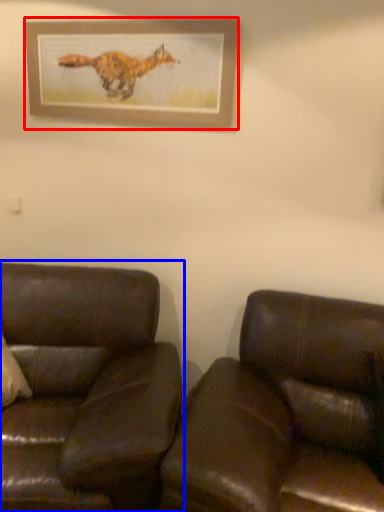
Question: Which object appears farthest to the camera in this image, picture frame (highlighted by a red box) or studio couch (highlighted by a blue box)?

Choices:
 (A) picture frame
 (B) studio couch

Answer: (A)